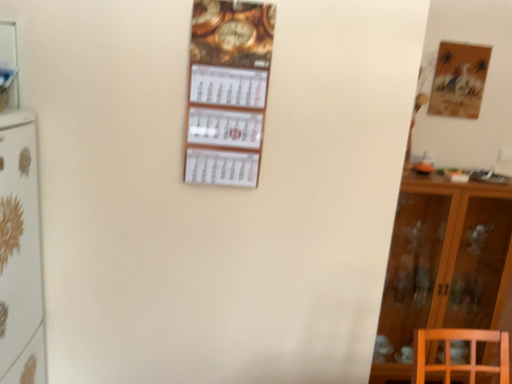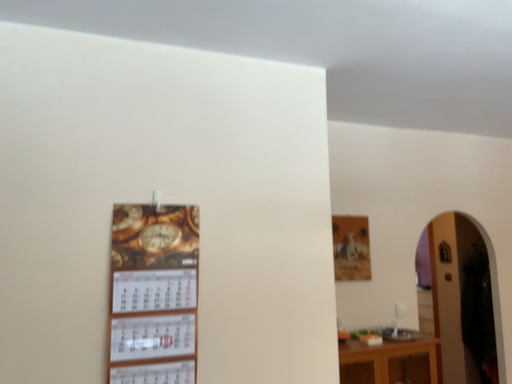
Question: Which way did the camera rotate in the video?

Choices:
 (A) rotated right
 (B) rotated left

Answer: (A)